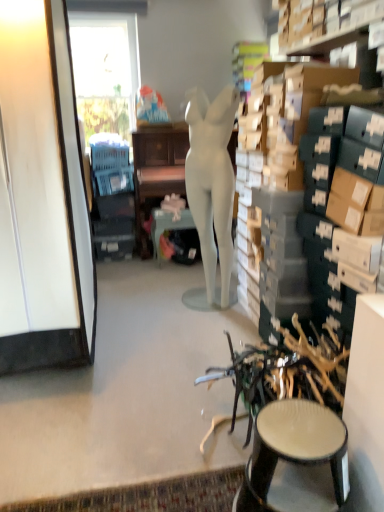
This screenshot has height=512, width=384. What are the coordinates of `matte white desk at center` in the screenshot? It's located at (157, 170).

The image size is (384, 512). In order to click on white glossy cabinet at left in this screenshot , I will do `click(42, 196)`.

In order to face matte black stool at lower right, should I rotate leftwards or rightwards?

Turn right approximately 12.824 degrees to face it.

What do you see at coordinates (297, 456) in the screenshot? I see `matte black stool at lower right` at bounding box center [297, 456].

Image resolution: width=384 pixels, height=512 pixels. What are the coordinates of `matte white desk at center` in the screenshot? It's located at (157, 170).

Looking at this image, is matte white desk at center at the back of metallic teal table at center?

metallic teal table at center is not turned away from matte white desk at center.

From a real-world perspective, which object rests below the other?

In real-world perspective, metallic teal table at center is lower.

Based on the photo, from the image's perspective, which one is positioned lower, metallic teal table at center or matte white desk at center?

metallic teal table at center.

Considering their positions, is matte white desk at center located in front of or behind matte black stool at lower right?

matte white desk at center is behind matte black stool at lower right.

I want to click on stool that appears below the matte white desk at center (from the image's perspective), so click(x=297, y=456).

How many degrees apart are the facing directions of matte white desk at center and matte black stool at lower right?

The angle between the facing direction of matte white desk at center and the facing direction of matte black stool at lower right is 90.8 degrees.

Who is bigger, matte white desk at center or matte black stool at lower right?

Bigger between the two is matte white desk at center.

In the scene shown: Does matte black stool at lower right appear on the left side of white glossy cabinet at left?

Incorrect, matte black stool at lower right is not on the left side of white glossy cabinet at left.

At what (x,y) coordinates should I click in order to perform the action: click on stool lying in front of the white glossy cabinet at left. Please return your answer as a coordinate pair (x, y). Looking at the image, I should click on coord(297,456).

Between matte black stool at lower right and white glossy cabinet at left, which one has more height?

white glossy cabinet at left is taller.

Is the surface of matte black stool at lower right in direct contact with white glossy cabinet at left?

There is a gap between matte black stool at lower right and white glossy cabinet at left.

Is matte white desk at center to the left of white glossy cabinet at left from the viewer's perspective?

No, matte white desk at center is not to the left of white glossy cabinet at left.

Considering the positions of points (138, 179) and (71, 196), is point (138, 179) closer to camera compared to point (71, 196)?

No, it is behind (71, 196).

From the image's perspective, who appears lower, matte white desk at center or white glossy cabinet at left?

white glossy cabinet at left.

Is matte white desk at center placed right next to white glossy cabinet at left?

matte white desk at center and white glossy cabinet at left are clearly separated.

From the image's perspective, is white glossy cabinet at left located beneath metallic teal table at center?

Actually, white glossy cabinet at left appears above metallic teal table at center in the image.

Which of these two, white glossy cabinet at left or metallic teal table at center, is smaller?

metallic teal table at center is smaller.

Looking at this image, would you say metallic teal table at center is part of white glossy cabinet at left's contents?

No, metallic teal table at center is located outside of white glossy cabinet at left.

Considering the relative positions of white glossy cabinet at left and metallic teal table at center in the image provided, is white glossy cabinet at left to the right of metallic teal table at center from the viewer's perspective?

In fact, white glossy cabinet at left is to the left of metallic teal table at center.

Is blue plastic swivel chair at left taller than white glossy cabinet at left?

No, blue plastic swivel chair at left is not taller than white glossy cabinet at left.

From a real-world perspective, between blue plastic swivel chair at left and white glossy cabinet at left, who is vertically lower?

In real-world perspective, blue plastic swivel chair at left is lower.

How different are the orientations of blue plastic swivel chair at left and white glossy cabinet at left in degrees?

The angle between the facing direction of blue plastic swivel chair at left and the facing direction of white glossy cabinet at left is 0.573 degrees.

Does blue plastic swivel chair at left lie behind white glossy cabinet at left?

Yes, it is behind white glossy cabinet at left.

Is point (224, 215) closer to viewer compared to point (40, 230)?

No.

Between matte white mannequin at center and white glossy cabinet at left, which one has smaller width?

matte white mannequin at center is thinner.

Between matte white mannequin at center and white glossy cabinet at left, which one has smaller size?

Smaller between the two is matte white mannequin at center.

Is matte white mannequin at center next to white glossy cabinet at left?

No.

I want to click on table on the left of the matte white desk at center, so click(168, 226).

Where is `desk above the matte black stool at lower right (from a real-world perspective)`? Image resolution: width=384 pixels, height=512 pixels. desk above the matte black stool at lower right (from a real-world perspective) is located at coordinates (157, 170).

Considering their positions, is white glossy cabinet at left positioned closer to matte white mannequin at center than matte black stool at lower right?

white glossy cabinet at left is positioned closer to the anchor matte white mannequin at center.

From the image, which object appears to be farther from metallic teal table at center, matte black stool at lower right or white glossy cabinet at left?

matte black stool at lower right is further to metallic teal table at center.

Looking at the image, which one is located further to white glossy cabinet at left, blue plastic swivel chair at left or matte white desk at center?

matte white desk at center is further to white glossy cabinet at left.

Looking at the image, which one is located closer to metallic teal table at center, matte black stool at lower right or matte white desk at center?

matte white desk at center is closer to metallic teal table at center.

Estimate the real-world distances between objects in this image. Which object is closer to metallic teal table at center, matte white desk at center or white glossy cabinet at left?

matte white desk at center is positioned closer to the anchor metallic teal table at center.

Which object lies nearer to the anchor point matte white desk at center, blue plastic swivel chair at left or matte black stool at lower right?

blue plastic swivel chair at left is positioned closer to the anchor matte white desk at center.

Which object lies nearer to the anchor point metallic teal table at center, blue plastic swivel chair at left or matte black stool at lower right?

The object closer to metallic teal table at center is blue plastic swivel chair at left.

Considering their positions, is metallic teal table at center positioned further to white glossy cabinet at left than matte white mannequin at center?

metallic teal table at center is positioned further to the anchor white glossy cabinet at left.

This screenshot has width=384, height=512. In order to click on cabinetry between matte black stool at lower right and matte white desk at center from front to back in this screenshot , I will do (42, 196).

Find the location of a particular element. The width and height of the screenshot is (384, 512). person between white glossy cabinet at left and metallic teal table at center from front to back is located at coordinates (212, 181).

Image resolution: width=384 pixels, height=512 pixels. Find the location of `cabinetry between matte black stool at lower right and blue plastic swivel chair at left in the front-back direction`. cabinetry between matte black stool at lower right and blue plastic swivel chair at left in the front-back direction is located at coordinates (42, 196).

Locate an element on the screen. The image size is (384, 512). cabinetry between matte black stool at lower right and metallic teal table at center along the z-axis is located at coordinates (42, 196).